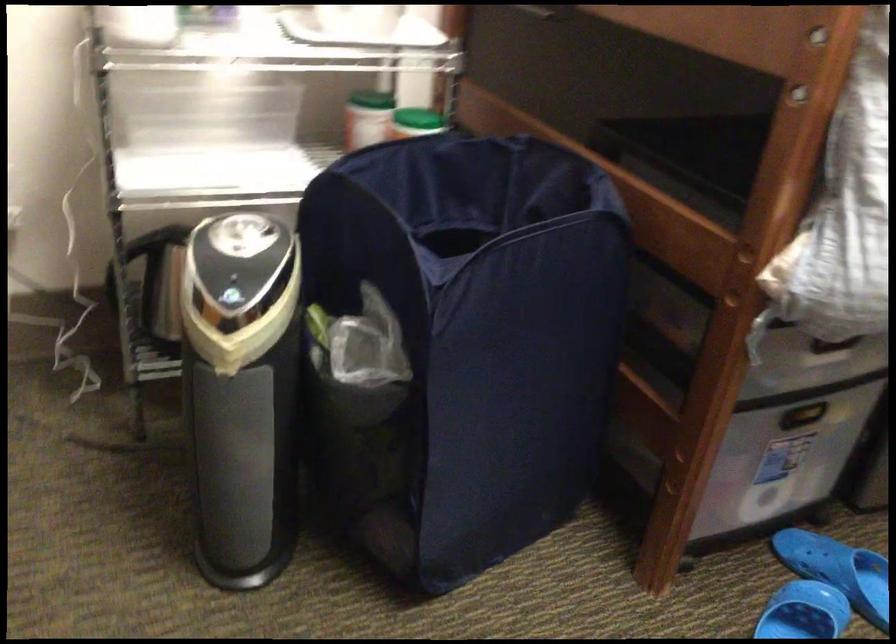
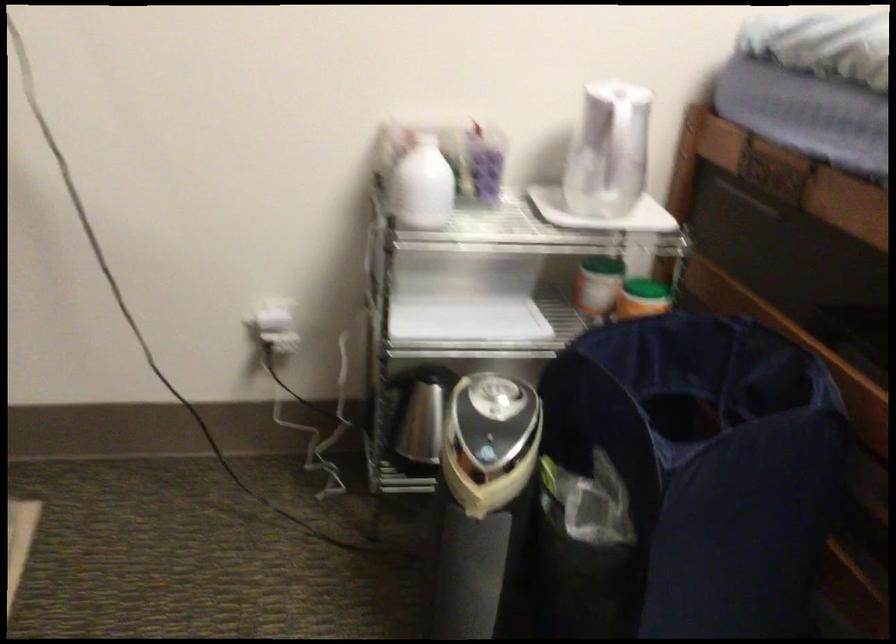
The point at (227, 298) is marked in the first image. Where is the corresponding point in the second image?

(486, 453)